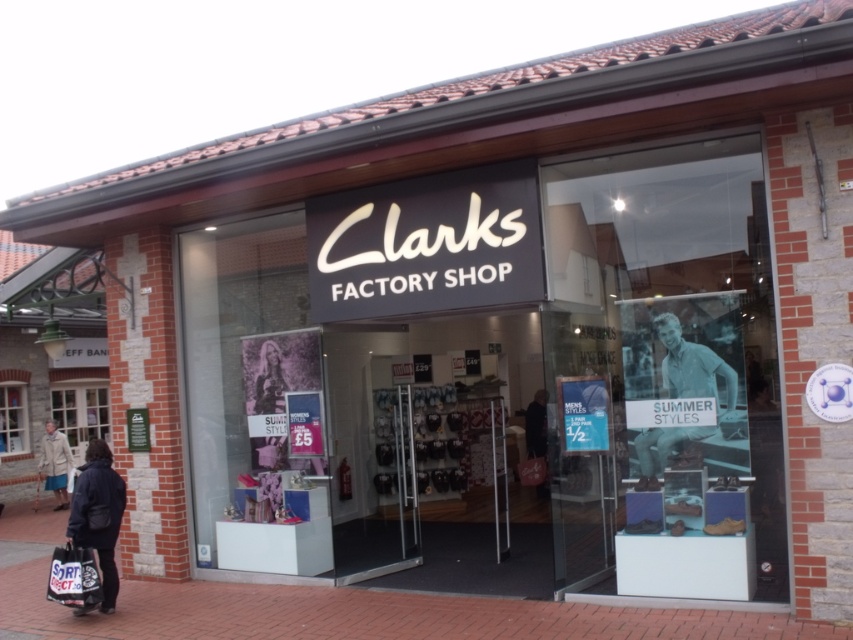
Question: Is light blue denim jeans at center positioned before matte black shopping bag at lower left?

Choices:
 (A) no
 (B) yes

Answer: (B)

Question: Which of these objects is positioned closest to the light blue denim jeans at center?

Choices:
 (A) matte black shopping bag at lower left
 (B) dark blue coat at lower left
 (C) brick pavement at lower center

Answer: (C)

Question: In this image, where is brick pavement at lower center located relative to dark blue coat at lower left?

Choices:
 (A) below
 (B) above

Answer: (A)

Question: Which object is closer to the camera taking this photo?

Choices:
 (A) light blue denim jeans at center
 (B) matte black shopping bag at lower left
 (C) brick pavement at lower center
 (D) dark blue coat at lower left

Answer: (C)

Question: Among these objects, which one is nearest to the camera?

Choices:
 (A) brick pavement at lower center
 (B) dark blue coat at lower left

Answer: (A)

Question: Does brick pavement at lower center have a smaller size compared to dark blue coat at lower left?

Choices:
 (A) yes
 (B) no

Answer: (A)